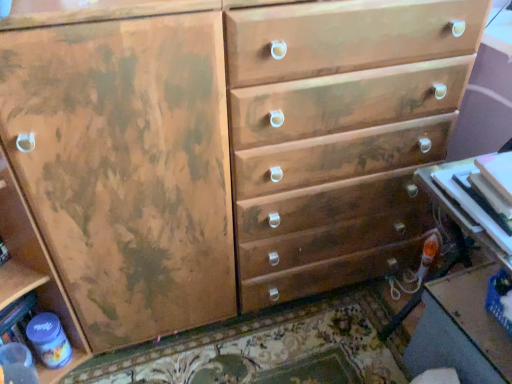
Question: Could you tell me if matte plastic bottle at lower left is facing white glossy table at lower right, the first table in the top-to-bottom sequence?

Choices:
 (A) yes
 (B) no

Answer: (B)

Question: Is matte plastic bottle at lower left shorter than white glossy table at lower right, the 2th table positioned from the bottom?

Choices:
 (A) yes
 (B) no

Answer: (B)

Question: Considering the relative sizes of matte plastic bottle at lower left and white glossy table at lower right, the first table in the top-to-bottom sequence, in the image provided, is matte plastic bottle at lower left bigger than white glossy table at lower right, the first table in the top-to-bottom sequence,?

Choices:
 (A) yes
 (B) no

Answer: (B)

Question: Can you see matte plastic bottle at lower left touching white glossy table at lower right, the first table in the top-to-bottom sequence?

Choices:
 (A) no
 (B) yes

Answer: (A)

Question: From a real-world perspective, is matte plastic bottle at lower left beneath white glossy table at lower right, positioned as the 2th table in back-to-front order?

Choices:
 (A) yes
 (B) no

Answer: (A)

Question: Is matte plastic table at lower right, which is counted as the second table, starting from the front, wider or thinner than white glossy table at lower right, the first table in the top-to-bottom sequence?

Choices:
 (A) thin
 (B) wide

Answer: (B)

Question: Would you say matte plastic table at lower right, which is counted as the second table, starting from the front, is inside or outside white glossy table at lower right, the first table in the top-to-bottom sequence?

Choices:
 (A) inside
 (B) outside

Answer: (B)

Question: From the image's perspective, is matte plastic table at lower right, acting as the second table starting from the top, positioned above or below white glossy table at lower right, positioned as the 2th table in back-to-front order?

Choices:
 (A) below
 (B) above

Answer: (A)

Question: Does point (445, 339) appear closer or farther from the camera than point (436, 193)?

Choices:
 (A) closer
 (B) farther

Answer: (B)

Question: Is white glossy table at lower right, which ranks as the 1th table in front-to-back order, taller or shorter than matte plastic bottle at lower left?

Choices:
 (A) short
 (B) tall

Answer: (A)

Question: Would you say white glossy table at lower right, the 2th table positioned from the bottom, is to the left or to the right of matte plastic bottle at lower left in the picture?

Choices:
 (A) left
 (B) right

Answer: (B)

Question: Considering their positions, is white glossy table at lower right, which ranks as the 1th table in front-to-back order, located in front of or behind matte plastic bottle at lower left?

Choices:
 (A) behind
 (B) front

Answer: (B)

Question: Is point (440, 180) closer or farther from the camera than point (61, 357)?

Choices:
 (A) farther
 (B) closer

Answer: (B)

Question: Choose the correct answer: Is matte plastic bottle at lower left inside white glossy table at lower right, the 2th table positioned from the bottom, or outside it?

Choices:
 (A) outside
 (B) inside

Answer: (A)

Question: In the image, is matte plastic bottle at lower left positioned in front of or behind white glossy table at lower right, which ranks as the 1th table in front-to-back order?

Choices:
 (A) front
 (B) behind

Answer: (B)